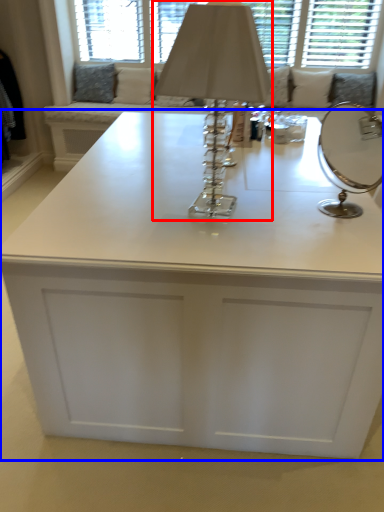
Question: Which point is further to the camera, table lamp (highlighted by a red box) or table (highlighted by a blue box)?

Choices:
 (A) table lamp
 (B) table

Answer: (B)